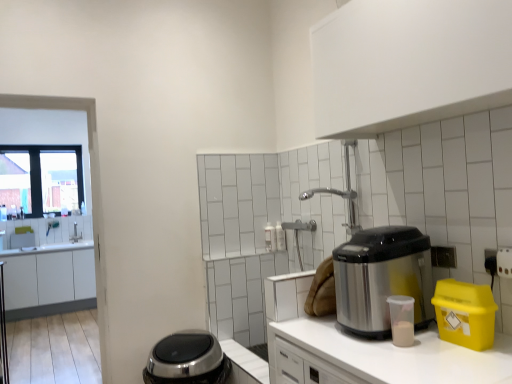
Locate an element on the screen. Image resolution: width=512 pixels, height=384 pixels. vacant space situated on the left part of stainless steel appliance at right is located at coordinates (320, 333).